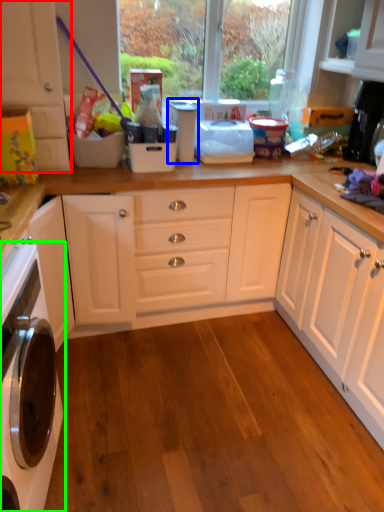
Question: Which is farther away from cabinetry (highlighted by a red box)? appliance (highlighted by a blue box) or home appliance (highlighted by a green box)?

Choices:
 (A) appliance
 (B) home appliance

Answer: (B)